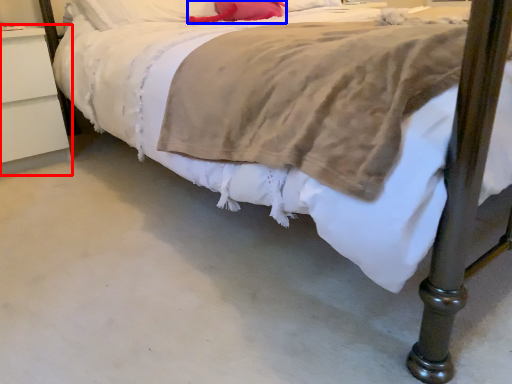
Question: Which object appears farthest to the camera in this image, nightstand (highlighted by a red box) or pillow (highlighted by a blue box)?

Choices:
 (A) nightstand
 (B) pillow

Answer: (B)